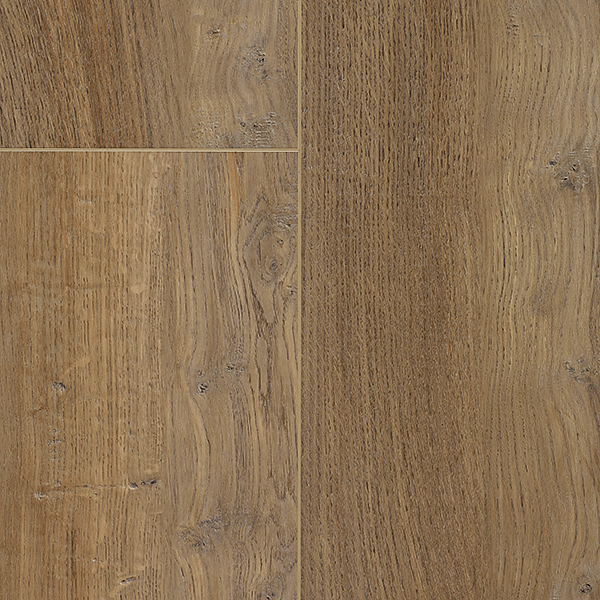
Where is `hard wood floor`? hard wood floor is located at coordinates (458, 287), (138, 114), (86, 411).